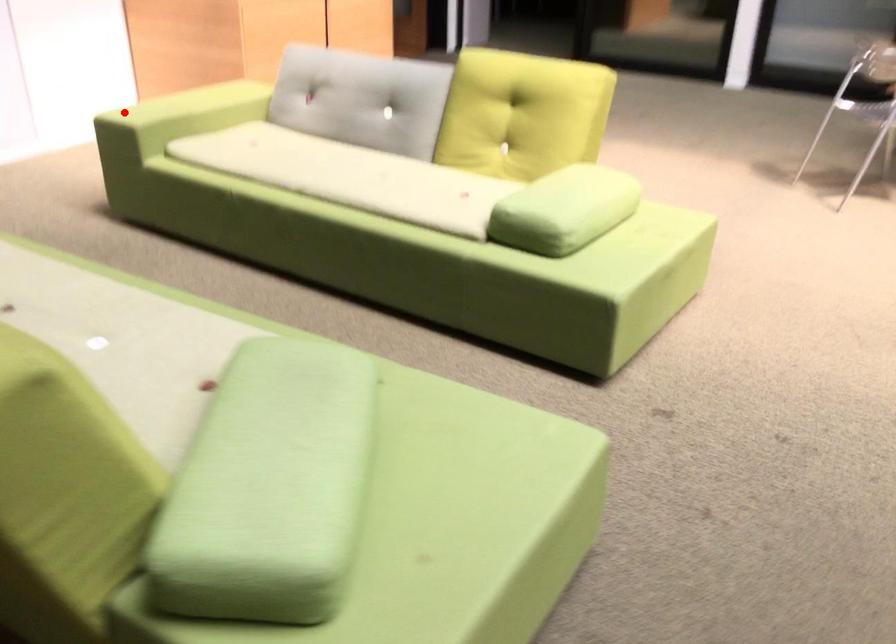
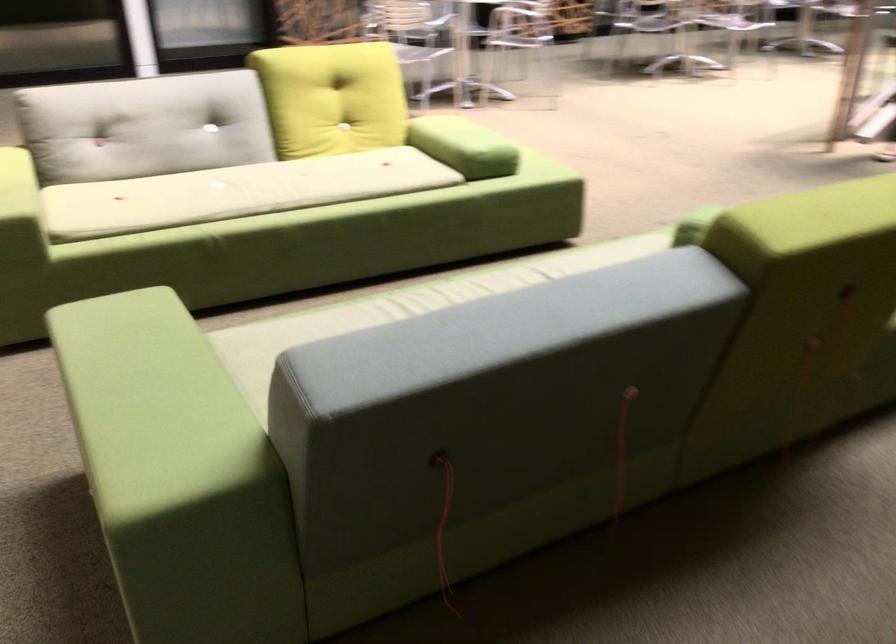
Question: A red point is marked in image1. In image2, is the corresponding 3D point closer to the camera or farther? Reply with the corresponding letter.

Choices:
 (A) The corresponding 3D point is closer.
 (B) The corresponding 3D point is farther.

Answer: (A)